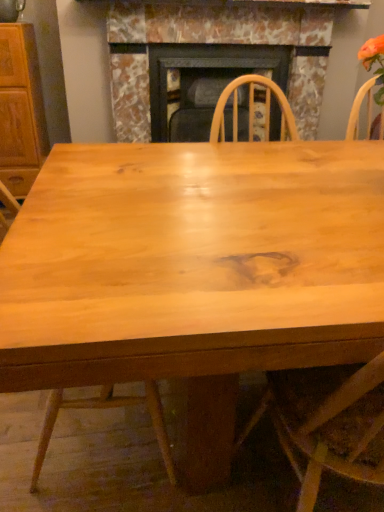
Question: From a real-world perspective, is wooden cabinet at left physically located above or below natural wood chair at center?

Choices:
 (A) above
 (B) below

Answer: (A)

Question: Is wooden cabinet at left situated inside natural wood chair at center or outside?

Choices:
 (A) outside
 (B) inside

Answer: (A)

Question: Estimate the real-world distances between objects in this image. Which object is closer to the marble fireplace at center?

Choices:
 (A) natural wood chair at center
 (B) wooden cabinet at left

Answer: (B)

Question: Considering the real-world distances, which object is farthest from the marble fireplace at center?

Choices:
 (A) natural wood chair at center
 (B) wooden cabinet at left

Answer: (A)